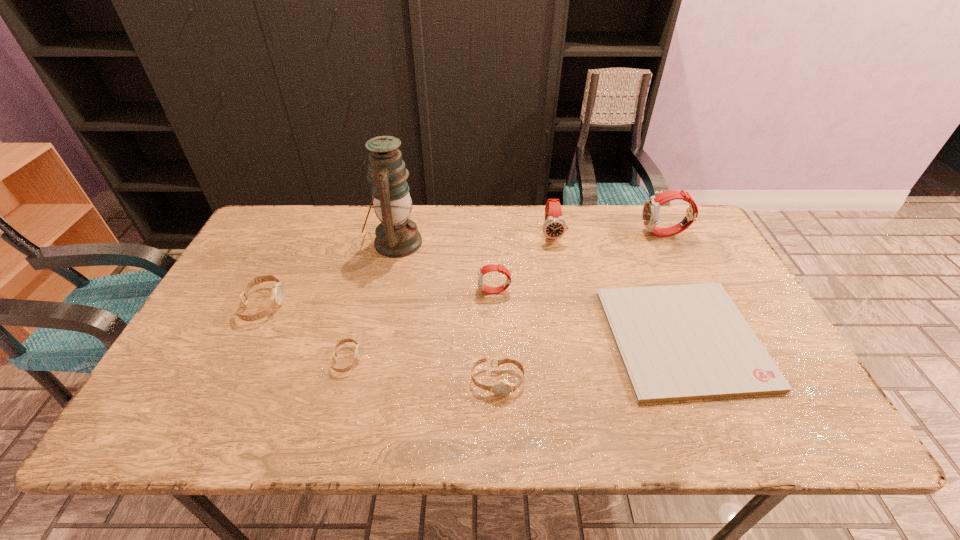
Locate an element on the screen. This screenshot has width=960, height=540. the sixth tallest object is located at coordinates (502, 387).

At what (x,y) coordinates should I click in order to perform the action: click on the second shortest watch. Please return your answer as a coordinate pair (x, y). The image size is (960, 540). Looking at the image, I should click on (502, 387).

Find the location of a particular element. the seventh tallest object is located at coordinates (357, 352).

I want to click on the fifth watch from right to left, so click(357, 352).

Find the location of a particular element. This screenshot has width=960, height=540. clipboard is located at coordinates (678, 342).

I want to click on free point located on the front of the rust oil lamp, so tap(381, 309).

Where is `vacant area situated on the face of the rightmost red watch`? vacant area situated on the face of the rightmost red watch is located at coordinates (594, 234).

At what (x,y) coordinates should I click in order to perform the action: click on vacant space located 0.380m on the face of the rightmost red watch. Please return your answer as a coordinate pair (x, y). Image resolution: width=960 pixels, height=540 pixels. Looking at the image, I should click on (523, 234).

Where is `blank area located on the face of the rightmost red watch`? The height and width of the screenshot is (540, 960). blank area located on the face of the rightmost red watch is located at coordinates (576, 234).

Identify the location of vacant space located 0.390m on the face of the second watch from right to left. (573, 345).